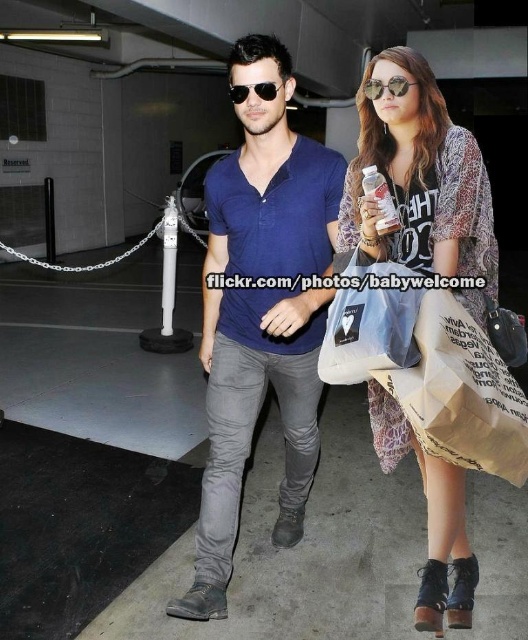
Who is positioned more to the left, printed chiffon dress at center or white paper bag at lower right?

From the viewer's perspective, printed chiffon dress at center appears more on the left side.

Who is taller, printed chiffon dress at center or white paper bag at lower right?

Standing taller between the two is printed chiffon dress at center.

I want to click on printed chiffon dress at center, so click(421, 182).

Is white paper bag at lower right closer to the viewer compared to light blue fabric shopping bag at center?

That is True.

Is white paper bag at lower right to the right of light blue fabric shopping bag at center from the viewer's perspective?

Yes, white paper bag at lower right is to the right of light blue fabric shopping bag at center.

At what (x,y) coordinates should I click in order to perform the action: click on white paper bag at lower right. Please return your answer as a coordinate pair (x, y). Looking at the image, I should click on (460, 394).

Is printed chiffon dress at center above shiny silver sunglasses at center?

Incorrect, printed chiffon dress at center is not positioned above shiny silver sunglasses at center.

This screenshot has width=528, height=640. Find the location of `printed chiffon dress at center`. printed chiffon dress at center is located at coordinates (421, 182).